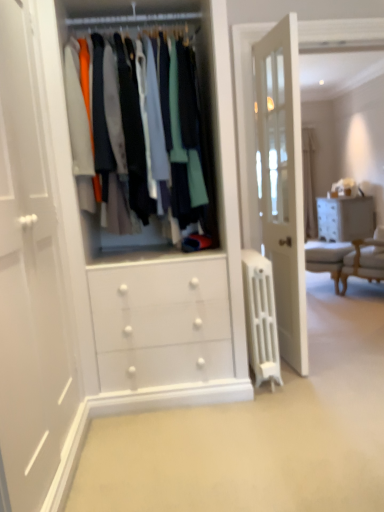
Identify the location of vacant space to the right of white painted radiator at center. The height and width of the screenshot is (512, 384). (329, 368).